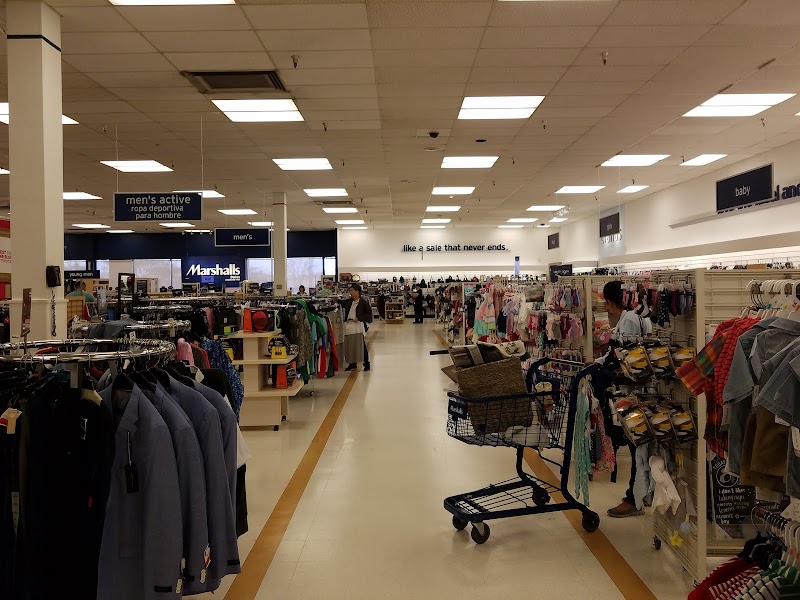
Where is `lights`? This screenshot has width=800, height=600. lights is located at coordinates (252, 112).